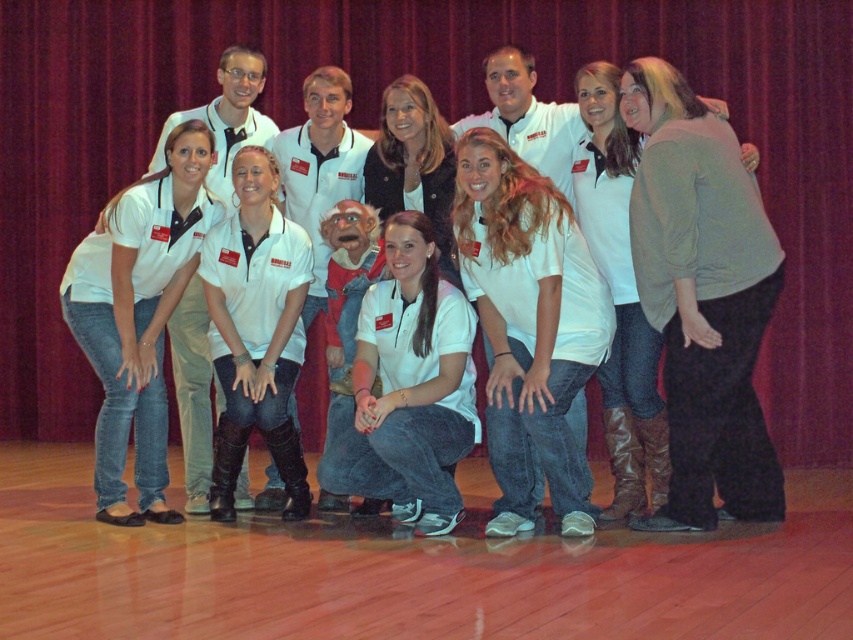
Is velvet red curtain at upper center taller than white matte shirt at center?

Correct, velvet red curtain at upper center is much taller as white matte shirt at center.

Is velvet red curtain at upper center shorter than white matte shirt at center?

Incorrect, velvet red curtain at upper center's height does not fall short of white matte shirt at center's.

Find the location of a particular element. velvet red curtain at upper center is located at coordinates (447, 120).

Between green textured sweater at right and white cotton shirt at center, which one is positioned lower?

white cotton shirt at center is below.

Between green textured sweater at right and white cotton shirt at center, which one has more height?

green textured sweater at right

Does point (701, 282) come closer to viewer compared to point (514, 458)?

Yes, point (701, 282) is closer to viewer.

I want to click on green textured sweater at right, so click(x=701, y=300).

Is point (120, 99) positioned after point (184, 172)?

Yes, it is behind point (184, 172).

Is velvet red curtain at upper center above white matte shirt at lower left?

Indeed, velvet red curtain at upper center is positioned over white matte shirt at lower left.

What do you see at coordinates (447, 120) in the screenshot? I see `velvet red curtain at upper center` at bounding box center [447, 120].

At what (x,y) coordinates should I click in order to perform the action: click on velvet red curtain at upper center. Please return your answer as a coordinate pair (x, y). Looking at the image, I should click on (447, 120).